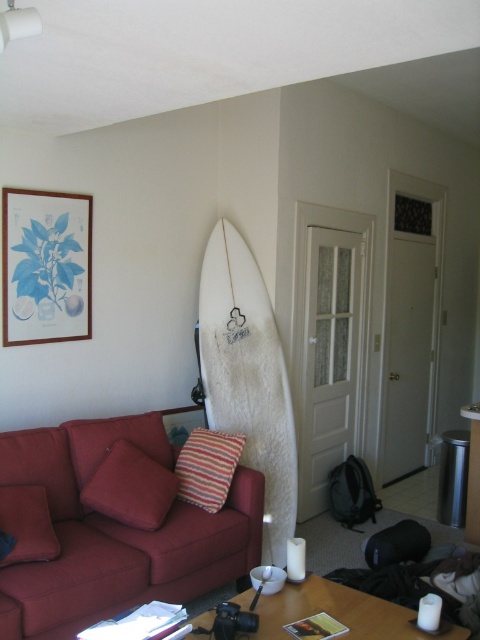
Is point (336, 595) behind point (182, 458)?

No, it is not.

You are a GUI agent. You are given a task and a screenshot of the screen. Output one action in this format:
    pyautogui.click(x=<x>, y=<y>)
    Task: Click on the white glossy table at lower center
    This screenshot has height=640, width=480.
    Given the screenshot: What is the action you would take?
    pyautogui.click(x=335, y=611)

Who is shorter, striped fabric pillow at center or striped fabric pillow at left?

With less height is striped fabric pillow at center.

Is point (134, 512) positioned before point (184, 468)?

Yes, point (134, 512) is in front of point (184, 468).

The width and height of the screenshot is (480, 640). I want to click on striped fabric pillow at center, so click(131, 486).

Which is below, wooden framed print at upper left or striped fabric pillow at center?

striped fabric pillow at center

Which is behind, point (48, 227) or point (135, 481)?

The point (48, 227) is more distant.

Where is `wooden framed print at upper left`? wooden framed print at upper left is located at coordinates 46,266.